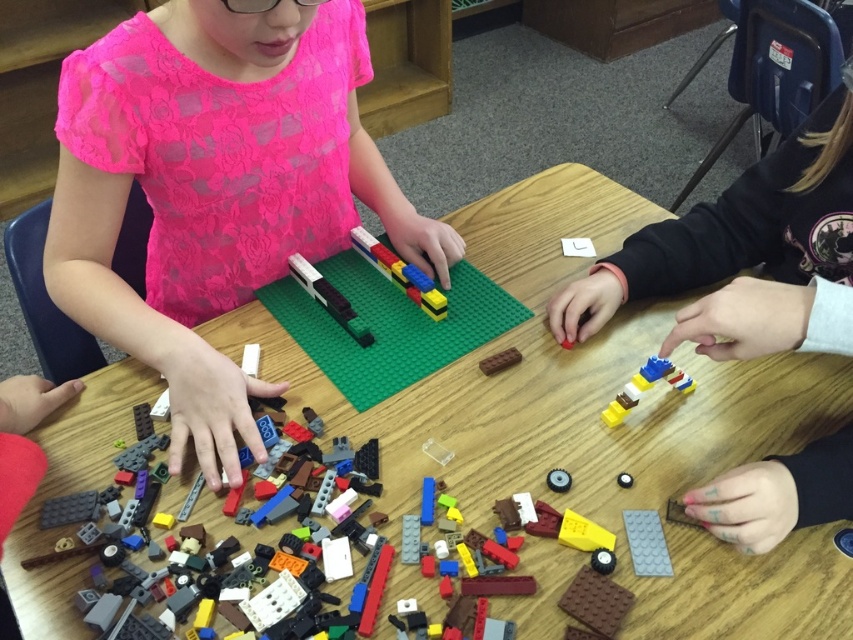
You are a child trying to build a LEGO train. You have a translucent plastic lego brick at center and a metallic silver gear at center on the table. Which object is located to the left of the other?

The translucent plastic lego brick at center is positioned on the left side of the metallic silver gear at center.

You are a child trying to build a LEGO train set. You have a translucent plastic lego brick at center and a metallic silver gear at center. Which piece can you use to attach more LEGO bricks to build the train structure?

The translucent plastic lego brick at center has a larger size compared to the metallic silver gear at center, so it can accommodate more LEGO bricks for building the train structure.

You are standing 1.5 meters away from the table where the LEGO activity is taking place. There is a specific point marked at coordinates point [289,266] on the table. Can you reach that point without moving closer to the table?

The distance of point [289,266] from the viewer is 1.06 meters. Since you are standing 1.5 meters away from the table, you are further away than the point, so you cannot reach it without moving closer.